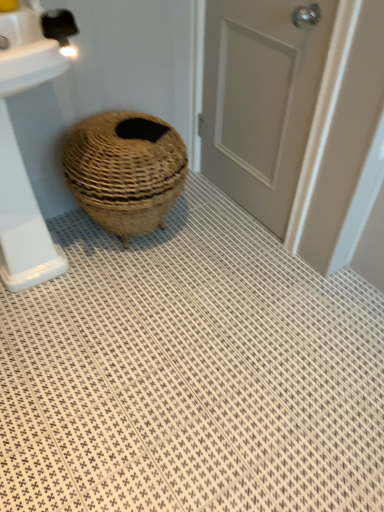
Where is `free location in front of natural woven basket at center`? This screenshot has height=512, width=384. free location in front of natural woven basket at center is located at coordinates (139, 304).